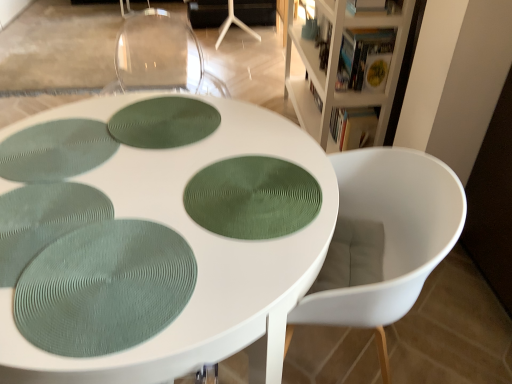
The height and width of the screenshot is (384, 512). I want to click on vacant area situated to the left side of green textured placemat at center, acting as the 2th oval starting from the front, so click(x=129, y=199).